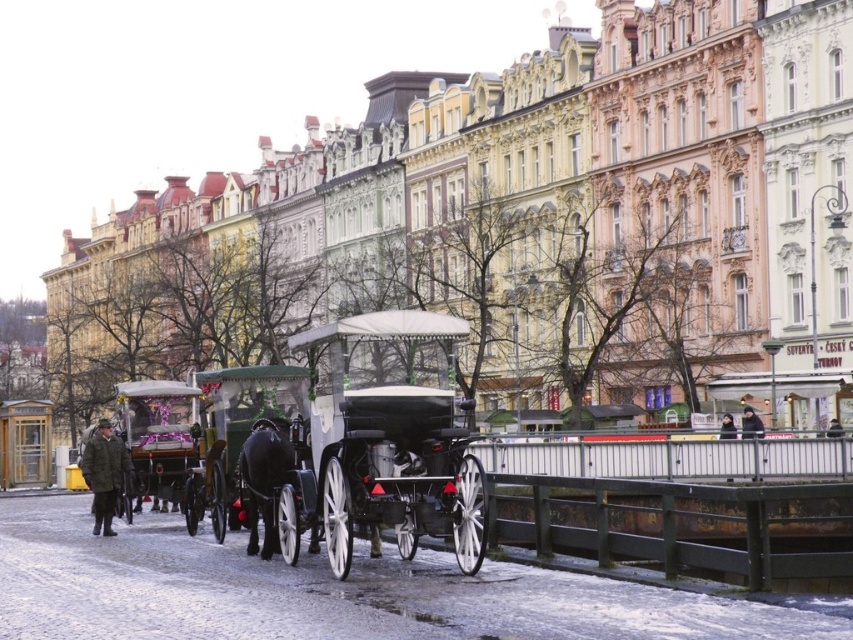
Question: Which object is closer to the camera taking this photo?

Choices:
 (A) shiny silver wagon at center
 (B) dark green wool coat at left

Answer: (B)

Question: Which object is farther from the camera taking this photo?

Choices:
 (A) black glossy horse at center
 (B) shiny silver wagon at center
 (C) dark gray coat at center
 (D) dark green wool coat at left

Answer: (B)

Question: Which point is farther from the camera taking this photo?

Choices:
 (A) (752, 428)
 (B) (199, 468)

Answer: (A)

Question: Can you confirm if shiny silver wagon at center is positioned above dark gray jacket at center?

Choices:
 (A) yes
 (B) no

Answer: (B)

Question: In this image, where is shiny black wagon at center located relative to dark green wool coat at left?

Choices:
 (A) right
 (B) left

Answer: (A)

Question: Does shiny silver wagon at center have a smaller size compared to dark green wool coat at left?

Choices:
 (A) no
 (B) yes

Answer: (B)